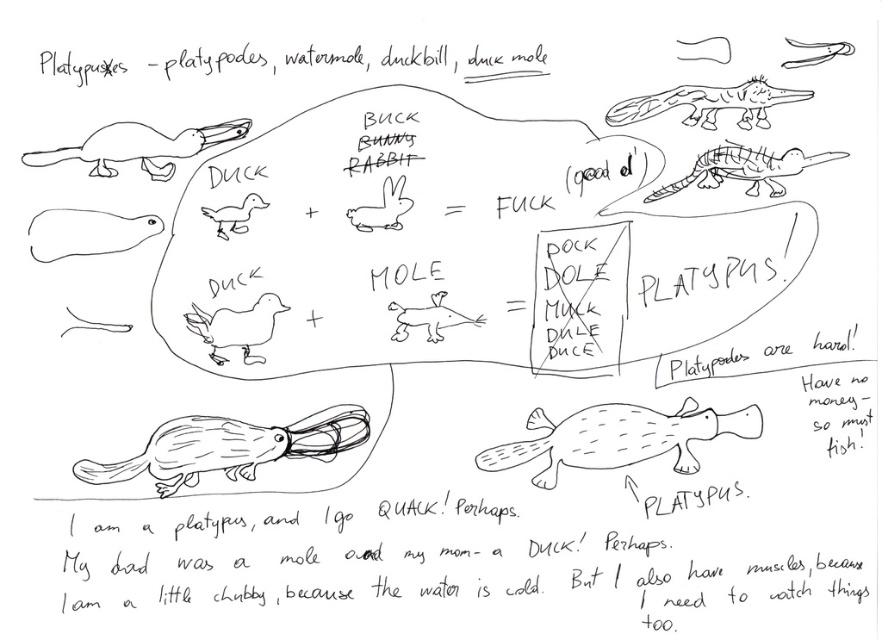
In the scene shown: Who is shorter, matte black platypus at upper center or matte black duck at upper center?

With less height is matte black platypus at upper center.

Is matte black platypus at upper center above matte black duck at upper center?

Yes, matte black platypus at upper center is above matte black duck at upper center.

Where is `matte black platypus at upper center`? The width and height of the screenshot is (882, 640). matte black platypus at upper center is located at coordinates (708, 104).

Can you confirm if shiny metallic lizard at upper right is smaller than brown furry mole at center?

Incorrect, shiny metallic lizard at upper right is not smaller in size than brown furry mole at center.

Does shiny metallic lizard at upper right have a lesser width compared to brown furry mole at center?

In fact, shiny metallic lizard at upper right might be wider than brown furry mole at center.

Locate an element on the screen. The height and width of the screenshot is (640, 882). shiny metallic lizard at upper right is located at coordinates (744, 170).

Identify the location of shiny metallic lizard at upper right. (744, 170).

Does brown furry platypus at lower left come behind shiny metallic lizard at upper right?

That is True.

At what (x,y) coordinates should I click in order to perform the action: click on brown furry platypus at lower left. Please return your answer as a coordinate pair (x, y). The height and width of the screenshot is (640, 882). Looking at the image, I should click on (230, 448).